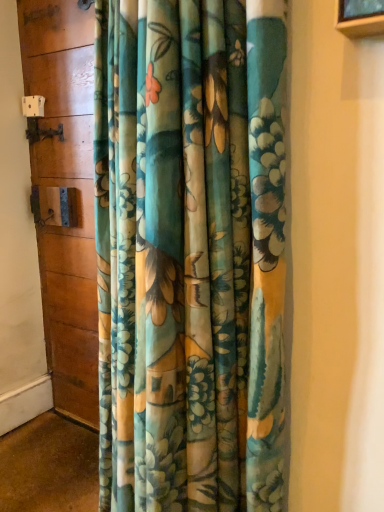
This screenshot has height=512, width=384. What are the coordinates of `vacant area situated below wooden door at left (from a real-world perspective)` in the screenshot? It's located at (80, 430).